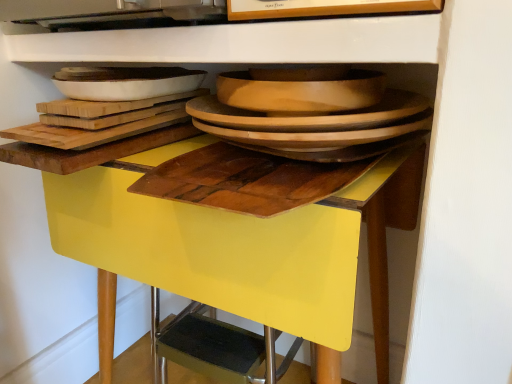
What do you see at coordinates (240, 246) in the screenshot? I see `yellow glossy table at center` at bounding box center [240, 246].

This screenshot has width=512, height=384. I want to click on yellow glossy table at center, so click(240, 246).

How many degrees apart are the facing directions of wooden cutting board at center and yellow glossy table at center?

3.7 degrees.

Which object is closer to the camera taking this photo, wooden cutting board at center or yellow glossy table at center?

Positioned in front is wooden cutting board at center.

Which object is positioned more to the right, wooden cutting board at center or yellow glossy table at center?

Positioned to the right is wooden cutting board at center.

Is point (228, 205) closer to viewer compared to point (67, 195)?

Yes, it is.

Which is in front, point (362, 90) or point (252, 318)?

Point (362, 90)

Which of these two, wooden platter at center, acting as the 1th platter starting from the right, or yellow glossy table at center, stands taller?

With more height is yellow glossy table at center.

Which object is positioned more to the right, wooden platter at center, the second platter in the left-to-right sequence, or yellow glossy table at center?

wooden platter at center, the second platter in the left-to-right sequence, is more to the right.

Is the depth of wooden platter at center, acting as the 1th platter starting from the right, greater than that of yellow glossy table at center?

Yes, wooden platter at center, acting as the 1th platter starting from the right, is further from the viewer.

Which of these two, yellow glossy table at center or white glossy platter at upper left, acting as the first platter starting from the left, is bigger?

yellow glossy table at center.

Is yellow glossy table at center at the left side of white glossy platter at upper left, which is the 2th platter from right to left?

No.

Could you tell me if yellow glossy table at center is turned towards white glossy platter at upper left, which is the 2th platter from right to left?

No, yellow glossy table at center is not aimed at white glossy platter at upper left, which is the 2th platter from right to left.

Is wooden cutting board at center far away from wooden platter at center, the second platter in the left-to-right sequence?

wooden cutting board at center is near wooden platter at center, the second platter in the left-to-right sequence, not far away.

Is wooden cutting board at center to the left or to the right of wooden platter at center, acting as the 1th platter starting from the right, in the image?

Clearly, wooden cutting board at center is on the left of wooden platter at center, acting as the 1th platter starting from the right, in the image.

From a real-world perspective, is wooden cutting board at center physically above wooden platter at center, acting as the 1th platter starting from the right?

Incorrect, from a real-world perspective, wooden cutting board at center is lower than wooden platter at center, acting as the 1th platter starting from the right.

From the image's perspective, is wooden cutting board at center on wooden platter at center, the second platter in the left-to-right sequence?

No, from the image's perspective, wooden cutting board at center is not above wooden platter at center, the second platter in the left-to-right sequence.

Does wooden cutting board at center touch white glossy platter at upper left, which is the 2th platter from right to left?

No, wooden cutting board at center is not touching white glossy platter at upper left, which is the 2th platter from right to left.

Between wooden cutting board at center and white glossy platter at upper left, acting as the first platter starting from the left, which one has smaller size?

Smaller between the two is wooden cutting board at center.

Is wooden cutting board at center taller than white glossy platter at upper left, acting as the first platter starting from the left?

Incorrect, the height of wooden cutting board at center is not larger of that of white glossy platter at upper left, acting as the first platter starting from the left.

Can you confirm if wooden cutting board at center is positioned to the right of white glossy platter at upper left, which is the 2th platter from right to left?

Yes.

From a real-world perspective, is white glossy platter at upper left, which is the 2th platter from right to left, physically below yellow glossy table at center?

Actually, white glossy platter at upper left, which is the 2th platter from right to left, is physically above yellow glossy table at center in the real world.

Does white glossy platter at upper left, which is the 2th platter from right to left, have a larger size compared to yellow glossy table at center?

Incorrect, white glossy platter at upper left, which is the 2th platter from right to left, is not larger than yellow glossy table at center.

Would you say yellow glossy table at center is part of white glossy platter at upper left, acting as the first platter starting from the left,'s contents?

No, white glossy platter at upper left, acting as the first platter starting from the left, does not contain yellow glossy table at center.

From the image's perspective, is yellow glossy table at center positioned above or below wooden cutting board at center?

yellow glossy table at center is situated lower than wooden cutting board at center in the image.

From the picture: In the image, is yellow glossy table at center on the left side or the right side of wooden cutting board at center?

yellow glossy table at center is to the left of wooden cutting board at center.

Who is taller, yellow glossy table at center or wooden cutting board at center?

yellow glossy table at center.

Does yellow glossy table at center have a greater width compared to wooden cutting board at center?

Indeed, yellow glossy table at center has a greater width compared to wooden cutting board at center.

The image size is (512, 384). In the image, there is a yellow glossy table at center. In order to click on cutting board above it (from the image's perspective) in this screenshot , I will do `click(247, 179)`.

Identify the location of table below the wooden platter at center, acting as the 1th platter starting from the right (from the image's perspective). The image size is (512, 384). (240, 246).

Based on their spatial positions, is wooden cutting board at center or white glossy platter at upper left, acting as the first platter starting from the left, further from yellow glossy table at center?

white glossy platter at upper left, acting as the first platter starting from the left, is further to yellow glossy table at center.

Which object lies nearer to the anchor point wooden cutting board at center, wooden platter at center, acting as the 1th platter starting from the right, or white glossy platter at upper left, acting as the first platter starting from the left?

wooden platter at center, acting as the 1th platter starting from the right.

Based on their spatial positions, is wooden cutting board at center or wooden platter at center, acting as the 1th platter starting from the right, closer to yellow glossy table at center?

Among the two, wooden cutting board at center is located nearer to yellow glossy table at center.

When comparing their distances from wooden platter at center, acting as the 1th platter starting from the right, does yellow glossy table at center or wooden cutting board at center seem further?

yellow glossy table at center.

Considering their positions, is white glossy platter at upper left, acting as the first platter starting from the left, positioned further to wooden cutting board at center than wooden platter at center, acting as the 1th platter starting from the right?

The object further to wooden cutting board at center is white glossy platter at upper left, acting as the first platter starting from the left.

From the image, which object appears to be nearer to yellow glossy table at center, white glossy platter at upper left, which is the 2th platter from right to left, or wooden cutting board at center?

wooden cutting board at center is positioned closer to the anchor yellow glossy table at center.

Looking at the image, which one is located closer to wooden platter at center, acting as the 1th platter starting from the right, yellow glossy table at center or white glossy platter at upper left, which is the 2th platter from right to left?

Among the two, white glossy platter at upper left, which is the 2th platter from right to left, is located nearer to wooden platter at center, acting as the 1th platter starting from the right.

From the image, which object appears to be farther from white glossy platter at upper left, which is the 2th platter from right to left, wooden platter at center, acting as the 1th platter starting from the right, or yellow glossy table at center?

yellow glossy table at center is further to white glossy platter at upper left, which is the 2th platter from right to left.

The width and height of the screenshot is (512, 384). I want to click on platter between white glossy platter at upper left, which is the 2th platter from right to left, and yellow glossy table at center from top to bottom, so click(x=300, y=92).

Where is `cutting board between white glossy platter at upper left, which is the 2th platter from right to left, and yellow glossy table at center from top to bottom`? This screenshot has height=384, width=512. cutting board between white glossy platter at upper left, which is the 2th platter from right to left, and yellow glossy table at center from top to bottom is located at coordinates (247, 179).

Locate an element on the screen. The height and width of the screenshot is (384, 512). cutting board between wooden platter at center, the second platter in the left-to-right sequence, and yellow glossy table at center, in the vertical direction is located at coordinates (247, 179).

Where is `cutting board located between white glossy platter at upper left, acting as the first platter starting from the left, and wooden platter at center, acting as the 1th platter starting from the right, in the left-right direction`? The image size is (512, 384). cutting board located between white glossy platter at upper left, acting as the first platter starting from the left, and wooden platter at center, acting as the 1th platter starting from the right, in the left-right direction is located at coordinates (247, 179).